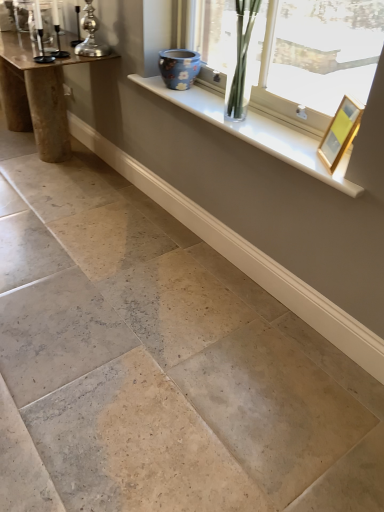
Where is `blank space above white glossy window sill at upper center (from a real-world perspective)`? The height and width of the screenshot is (512, 384). blank space above white glossy window sill at upper center (from a real-world perspective) is located at coordinates (243, 122).